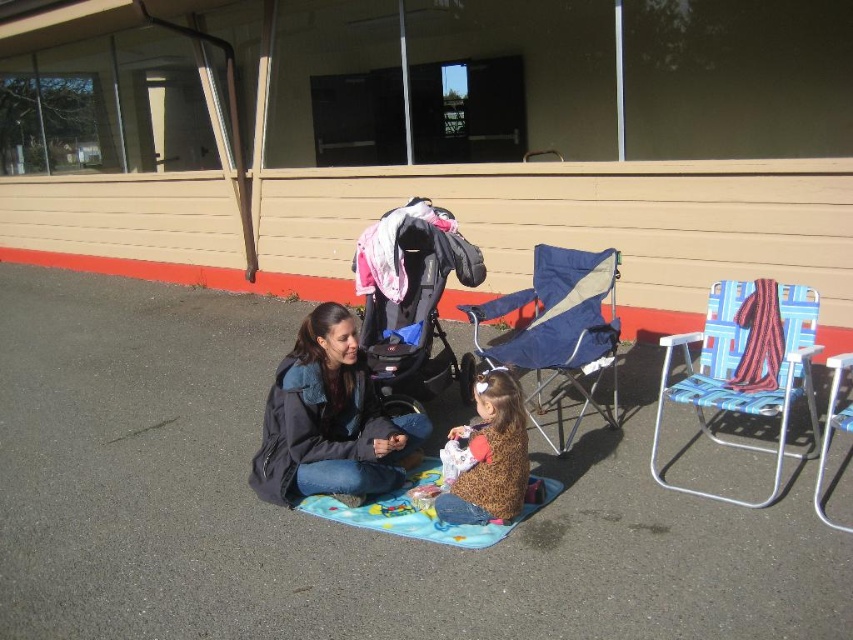
You are standing at the picnic blanket and want to reach the point at coordinates point (738, 371) and point (837, 410). Which point is closer to you?

Point (738, 371) is in front of point (837, 410), so it is closer to you.

You are a parent trying to organize your picnic items. You have a black textured stroller at center and a blue fabric chair at center. Which object should you move if you want to place a new item between them?

You should move the blue fabric chair at center to the right since the black textured stroller at center is already to the left of it, creating space in between.